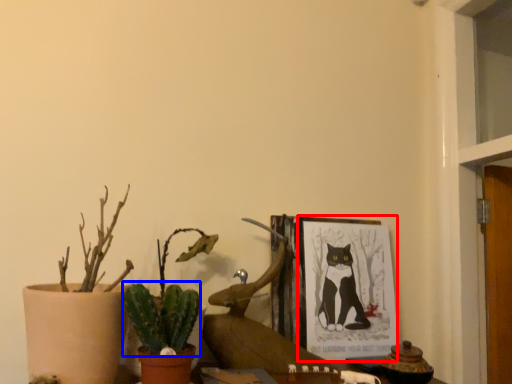
Question: Which point is further to the camera, picture frame (highlighted by a red box) or plant (highlighted by a blue box)?

Choices:
 (A) picture frame
 (B) plant

Answer: (A)